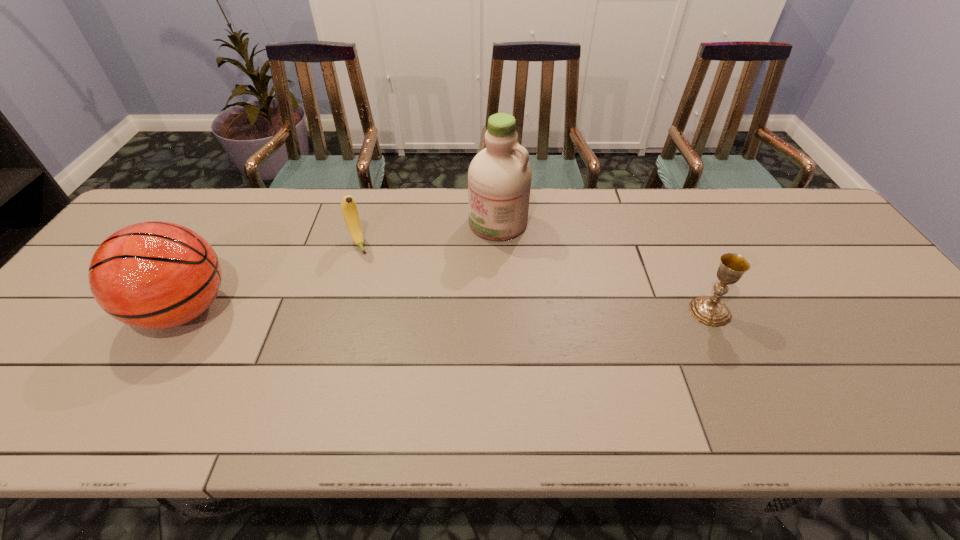
This screenshot has height=540, width=960. I want to click on free spot between the chalice and the second object from left to right, so click(534, 278).

You are a GUI agent. You are given a task and a screenshot of the screen. Output one action in this format:
    pyautogui.click(x=<x>, y=<y>)
    Task: Click on the vacant region between the chalice and the banana
    This screenshot has width=960, height=540.
    Given the screenshot: What is the action you would take?
    pyautogui.click(x=534, y=278)

Locate an element on the screen. This screenshot has width=960, height=540. free spot between the third object from left to right and the rightmost object is located at coordinates (604, 267).

Where is `vacant space that is in between the third object from right to left and the third shortest object`? This screenshot has height=540, width=960. vacant space that is in between the third object from right to left and the third shortest object is located at coordinates (272, 277).

The height and width of the screenshot is (540, 960). Find the location of `vacant point located between the chalice and the basketball`. vacant point located between the chalice and the basketball is located at coordinates (447, 310).

Image resolution: width=960 pixels, height=540 pixels. I want to click on free area in between the chalice and the basketball, so click(x=447, y=310).

Find the location of a particular element. The image size is (960, 540). empty space between the third object from left to right and the second tallest object is located at coordinates (342, 267).

Locate an element on the screen. vacant region between the second tallest object and the rightmost object is located at coordinates (447, 310).

This screenshot has width=960, height=540. What are the coordinates of `vacant space that's between the chalice and the cleansing agent` in the screenshot? It's located at (604, 267).

You are a GUI agent. You are given a task and a screenshot of the screen. Output one action in this format:
    pyautogui.click(x=<x>, y=<y>)
    Task: Click on the empty space that is in between the chalice and the tallest object
    The width and height of the screenshot is (960, 540).
    Given the screenshot: What is the action you would take?
    pyautogui.click(x=604, y=267)